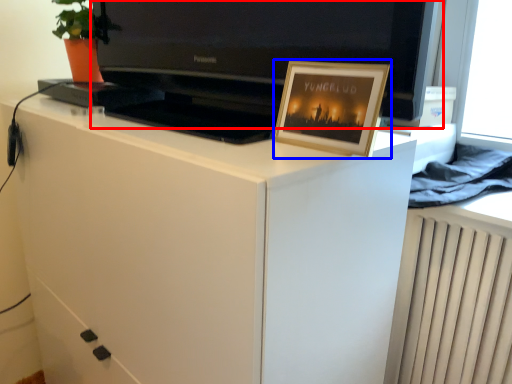
Question: Among these objects, which one is farthest to the camera, television (highlighted by a red box) or picture frame (highlighted by a blue box)?

Choices:
 (A) television
 (B) picture frame

Answer: (B)